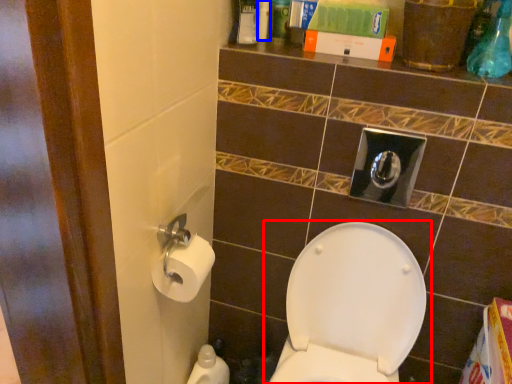
Question: Which object is further to the camera taking this photo, toilet (highlighted by a red box) or toiletry (highlighted by a blue box)?

Choices:
 (A) toilet
 (B) toiletry

Answer: (B)